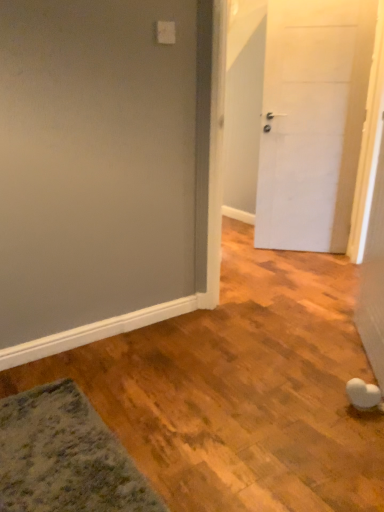
Image resolution: width=384 pixels, height=512 pixels. What do you see at coordinates (312, 121) in the screenshot?
I see `white matte door at upper right` at bounding box center [312, 121].

Locate an element on the screen. The height and width of the screenshot is (512, 384). white matte door at upper right is located at coordinates (312, 121).

Measure the distance between white matte door at upper right and camera.

A distance of 8.62 feet exists between white matte door at upper right and camera.

Locate an element on the screen. white matte door at upper right is located at coordinates (312, 121).